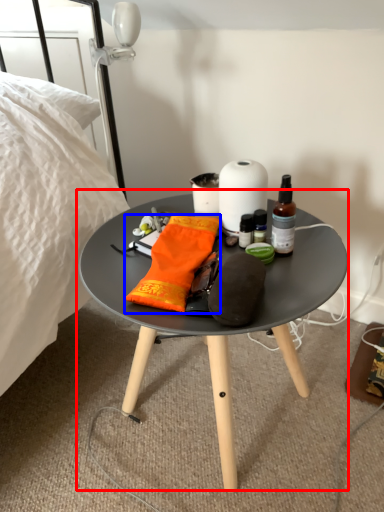
Question: Which object appears farthest to the camera in this image, coffee table (highlighted by a red box) or material (highlighted by a blue box)?

Choices:
 (A) coffee table
 (B) material

Answer: (B)